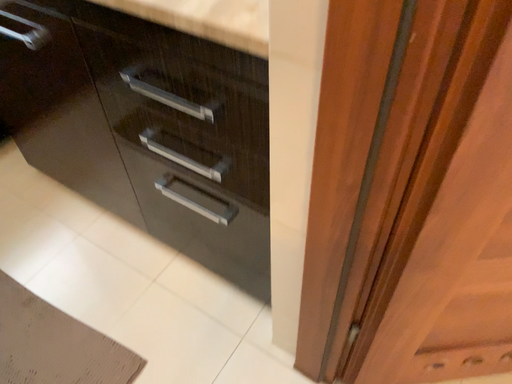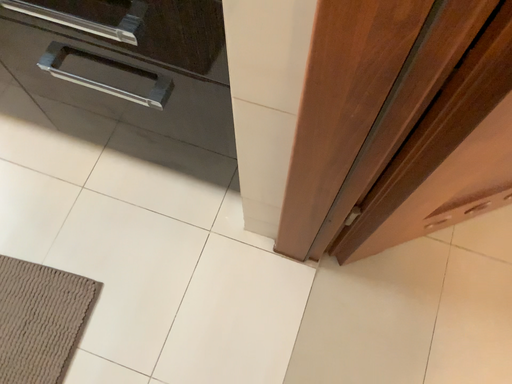
Question: Which way did the camera rotate in the video?

Choices:
 (A) rotated upward
 (B) rotated downward

Answer: (B)